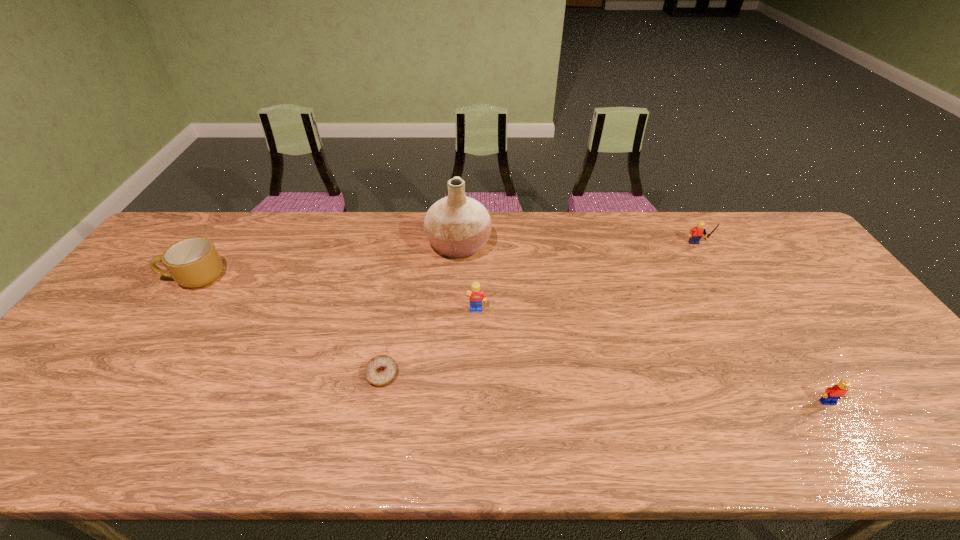
Where is `blank space at the far edge`? blank space at the far edge is located at coordinates (641, 213).

Find the location of a particular element. vacant point at the near edge is located at coordinates (792, 453).

Locate an element on the screen. Image resolution: width=960 pixels, height=540 pixels. vacant space at the left edge is located at coordinates (81, 415).

In the image, there is a desktop. Where is `vacant space at the right edge`? The height and width of the screenshot is (540, 960). vacant space at the right edge is located at coordinates (882, 369).

You are a GUI agent. You are given a task and a screenshot of the screen. Output one action in this format:
    pyautogui.click(x=<x>, y=<y>)
    Task: Click on the vacant region at the far left corner of the desktop
    
    Given the screenshot: What is the action you would take?
    pyautogui.click(x=194, y=228)

This screenshot has width=960, height=540. Identify the location of vacant space that's between the doughnut and the pottery. click(x=420, y=310).

You are a GUI agent. You are given a task and a screenshot of the screen. Output one action in this format:
    pyautogui.click(x=<x>, y=<y>)
    Task: Click on the free spot between the second object from right to left and the leftmost object
    The height and width of the screenshot is (540, 960).
    Given the screenshot: What is the action you would take?
    pyautogui.click(x=445, y=262)

You are a GUI agent. You are given a task and a screenshot of the screen. Output one action in this format:
    pyautogui.click(x=<x>, y=<y>)
    Task: Click on the unoccupied area between the tallest object and the nearest Lego
    
    Given the screenshot: What is the action you would take?
    pyautogui.click(x=643, y=324)

The height and width of the screenshot is (540, 960). I want to click on vacant area that lies between the rightmost Lego and the leftmost object, so click(512, 340).

Image resolution: width=960 pixels, height=540 pixels. What are the coordinates of `unoccupied position between the tallest object and the shortest object` in the screenshot? It's located at (420, 310).